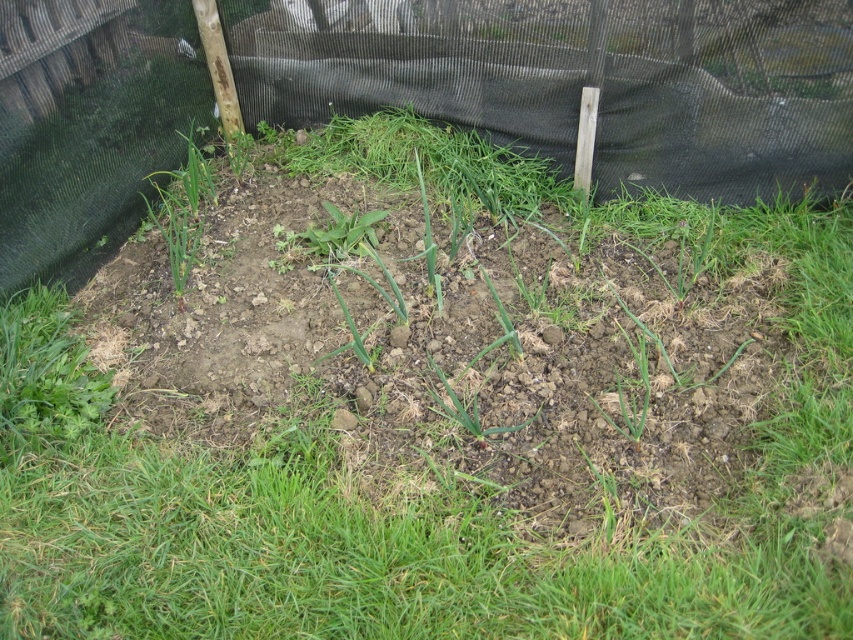
Is point (41, 76) less distant than point (184, 176)?

Yes.

Is the position of black mesh fence at upper center more distant than that of green grass at upper left?

No.

Where is `black mesh fence at upper center`? Image resolution: width=853 pixels, height=640 pixels. black mesh fence at upper center is located at coordinates (576, 81).